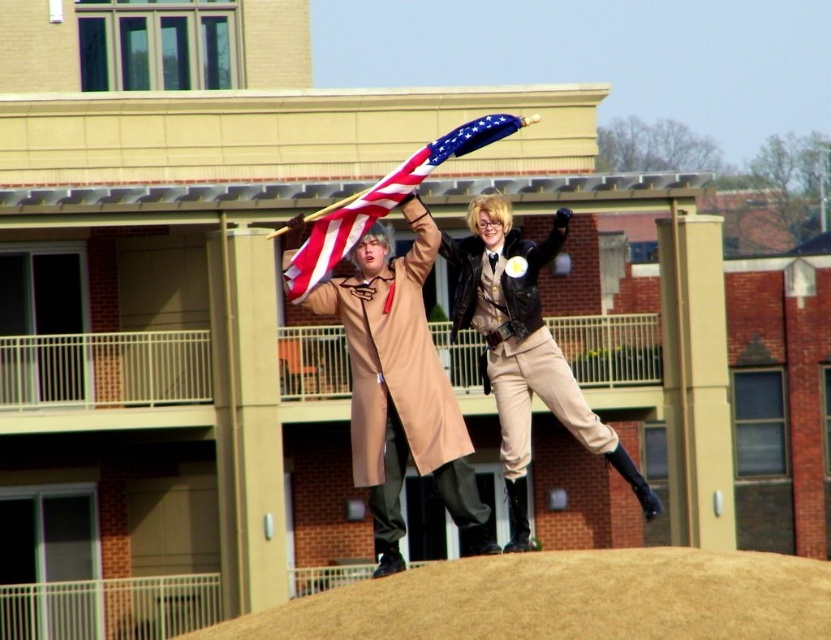
Is tan leather coat at center above tan leather trench coat at center?

No, tan leather coat at center is not above tan leather trench coat at center.

Does point (350, 336) lie in front of point (519, 340)?

That is False.

What are the coordinates of `tan leather coat at center` in the screenshot? It's located at (401, 387).

Identify the location of tan leather coat at center. (401, 387).

Between tan leather coat at center and american flag at center, which one has more height?

tan leather coat at center is taller.

How distant is tan leather coat at center from american flag at center?

tan leather coat at center and american flag at center are 5.38 feet apart from each other.

Image resolution: width=831 pixels, height=640 pixels. Find the location of `tan leather coat at center`. tan leather coat at center is located at coordinates (401, 387).

Where is `tan leather coat at center`? The image size is (831, 640). tan leather coat at center is located at coordinates (401, 387).

Is brown textured mound at lower center to the left of tan leather trench coat at center from the viewer's perspective?

In fact, brown textured mound at lower center is to the right of tan leather trench coat at center.

Is point (814, 563) positioned after point (530, 400)?

That is False.

The image size is (831, 640). I want to click on brown textured mound at lower center, so click(x=564, y=600).